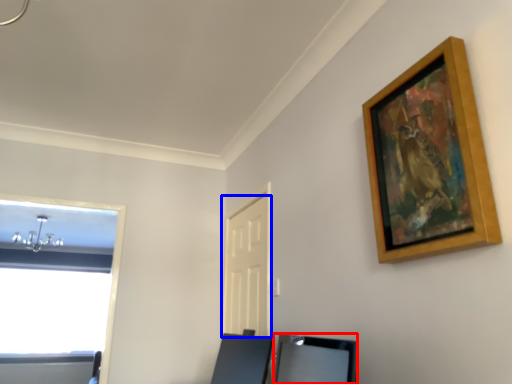
Question: Among these objects, which one is nearest to the camera, vanity (highlighted by a red box) or door (highlighted by a blue box)?

Choices:
 (A) vanity
 (B) door

Answer: (A)